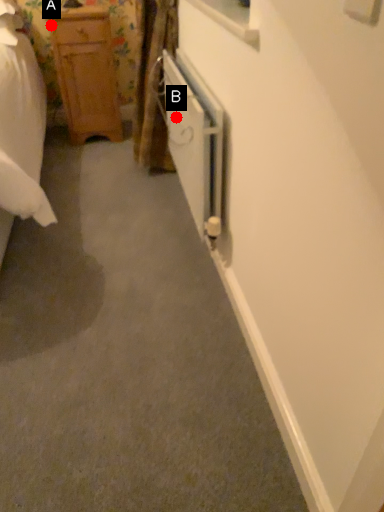
Question: Two points are circled on the image, labeled by A and B beside each circle. Among these points, which one is farthest from the camera?

Choices:
 (A) A is further
 (B) B is further

Answer: (A)